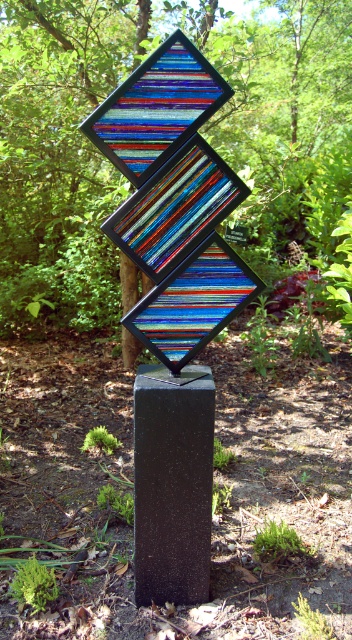
Can you confirm if green leafy tree at center is shorter than black polished stone at center?

No, green leafy tree at center is not shorter than black polished stone at center.

Between green leafy tree at center and black polished stone at center, which one is positioned higher?

green leafy tree at center

In the scene shown: Who is more distant from viewer, [316,172] or [147,486]?

The point [316,172] is behind.

This screenshot has width=352, height=640. In order to click on green leafy tree at center in this screenshot , I will do `click(60, 161)`.